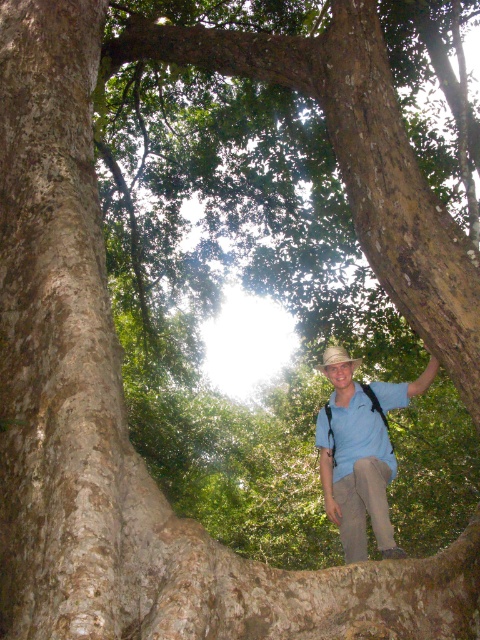
Question: Is blue cotton shirt at center below light blue cotton shirt at center?

Choices:
 (A) no
 (B) yes

Answer: (B)

Question: Which point is farther from the camera taking this photo?

Choices:
 (A) (387, 436)
 (B) (380, 422)

Answer: (A)

Question: Does blue cotton shirt at center appear on the left side of light blue cotton shirt at center?

Choices:
 (A) yes
 (B) no

Answer: (B)

Question: Can you confirm if blue cotton shirt at center is bigger than light blue cotton shirt at center?

Choices:
 (A) yes
 (B) no

Answer: (A)